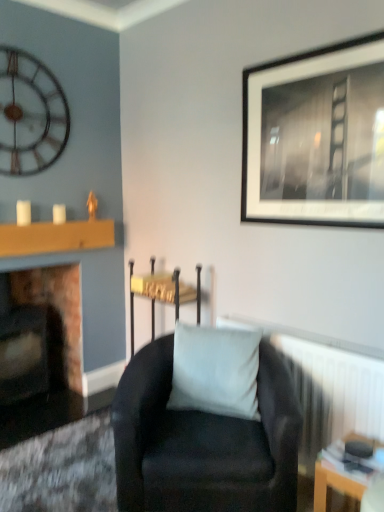
Where is `free spot below black matte picture frame at upper right (from a real-world perspective)`? This screenshot has height=512, width=384. free spot below black matte picture frame at upper right (from a real-world perspective) is located at coordinates (305, 326).